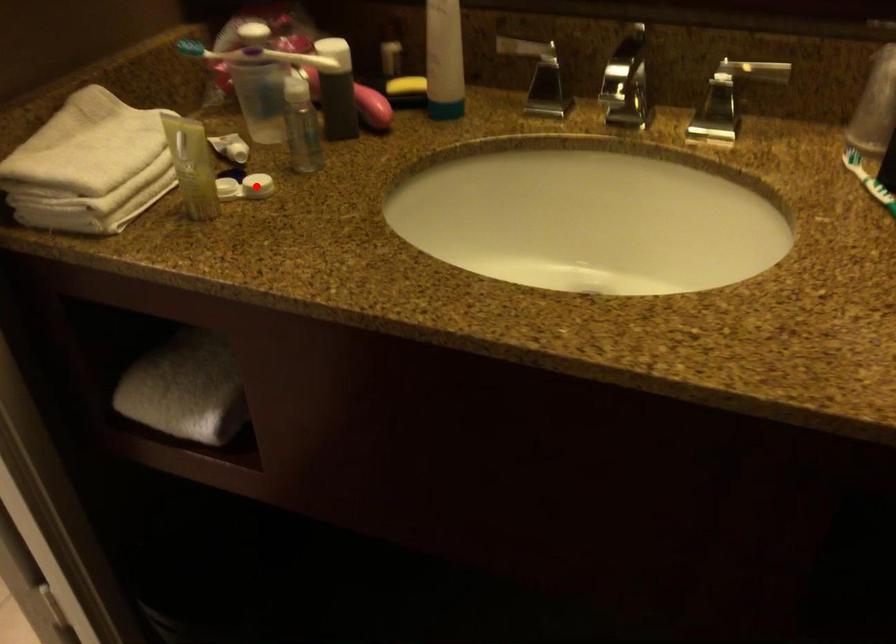
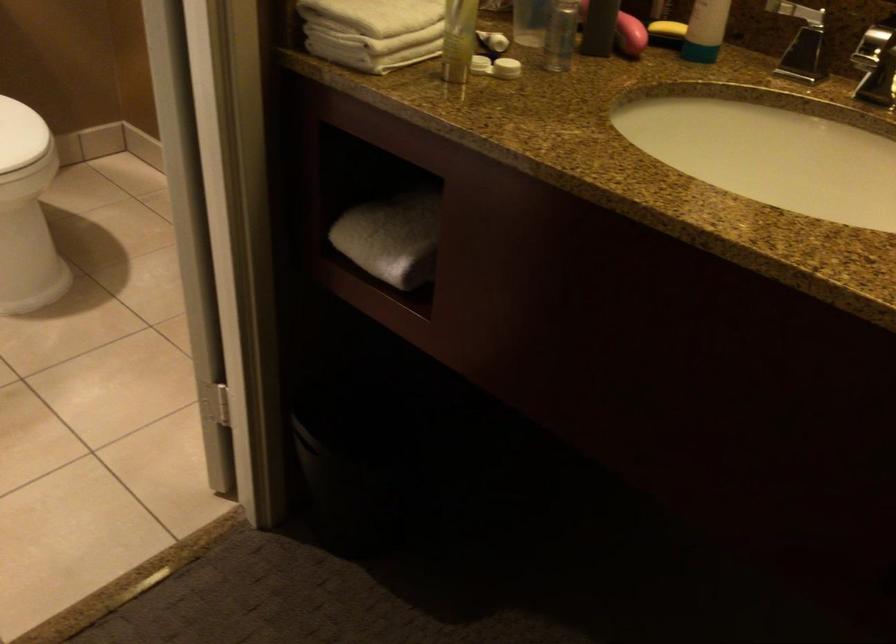
Locate, in the second image, the point that corresponds to the highlighted location in the first image.

(506, 68)